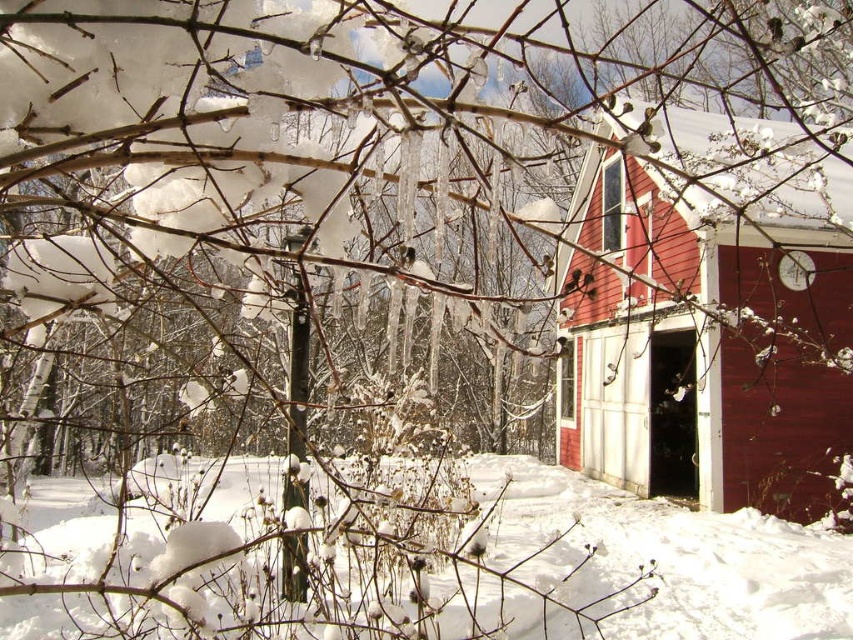
Question: Does smooth red cabin at center appear under white fluffy snow at lower center?

Choices:
 (A) no
 (B) yes

Answer: (A)

Question: Observing the image, what is the correct spatial positioning of smooth red cabin at center in reference to white fluffy snow at lower center?

Choices:
 (A) above
 (B) below

Answer: (A)

Question: Which of the following is the closest to the observer?

Choices:
 (A) (763, 596)
 (B) (564, 275)

Answer: (A)

Question: Does smooth red cabin at center appear on the right side of white fluffy snow at lower center?

Choices:
 (A) yes
 (B) no

Answer: (A)